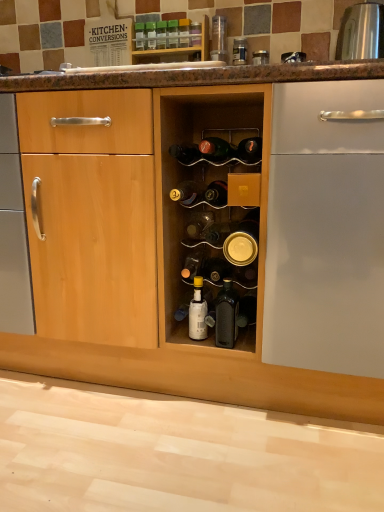
The image size is (384, 512). Describe the element at coordinates (177, 48) in the screenshot. I see `wooden spice rack at upper center` at that location.

What is the approximate height of translucent glass bottle at center, the seventh bottle in the bottom-to-top sequence?

translucent glass bottle at center, the seventh bottle in the bottom-to-top sequence, is 3.16 inches in height.

This screenshot has width=384, height=512. Find the location of `green glass bottle at center`. green glass bottle at center is located at coordinates (216, 149).

In order to face transparent plastic container at upper center, positioned as the 9th bottle in bottom-to-top order, should I rotate leftwards or rightwards?

Turn right approximately 0.521 degrees to face it.

Image resolution: width=384 pixels, height=512 pixels. What do you see at coordinates (195, 34) in the screenshot?
I see `transparent plastic container at upper center, positioned as the 9th bottle in bottom-to-top order` at bounding box center [195, 34].

Locate an element on the screen. matte black bottle at center, marked as the 4th bottle in a bottom-to-top arrangement is located at coordinates (193, 265).

At what (x,y) coordinates should I click in order to perform the action: click on the 9th bottle above when counting from the matte black bottle at center, the 3th bottle when ordered from bottom to top (from the image's perspective). Please return your answer as a coordinate pair (x, y). Looking at the image, I should click on (151, 35).

Would you say green glass bottle at center, acting as the second bottle starting from the top, is inside or outside matte black bottle at center, which is the 11th bottle in top-to-bottom order?

green glass bottle at center, acting as the second bottle starting from the top, is spatially situated outside matte black bottle at center, which is the 11th bottle in top-to-bottom order.

How different are the orientations of green glass bottle at center, the 12th bottle positioned from the bottom, and matte black bottle at center, which is the 11th bottle in top-to-bottom order, in degrees?

green glass bottle at center, the 12th bottle positioned from the bottom, and matte black bottle at center, which is the 11th bottle in top-to-bottom order, are facing 2.62 degrees away from each other.

Consider the image. From the image's perspective, would you say green glass bottle at center, acting as the second bottle starting from the top, is shown under matte black bottle at center, which is the 11th bottle in top-to-bottom order?

No, from the image's perspective, green glass bottle at center, acting as the second bottle starting from the top, is not below matte black bottle at center, which is the 11th bottle in top-to-bottom order.

Choose the correct answer: Is translucent glass bottle at center, the eighth bottle in the top-to-bottom sequence, inside matte black bottle at center, marked as the 4th bottle in a bottom-to-top arrangement, or outside it?

translucent glass bottle at center, the eighth bottle in the top-to-bottom sequence, is not enclosed by matte black bottle at center, marked as the 4th bottle in a bottom-to-top arrangement.

Considering the sizes of translucent glass bottle at center, the eighth bottle in the top-to-bottom sequence, and matte black bottle at center, marked as the 4th bottle in a bottom-to-top arrangement, in the image, is translucent glass bottle at center, the eighth bottle in the top-to-bottom sequence, bigger or smaller than matte black bottle at center, marked as the 4th bottle in a bottom-to-top arrangement,?

A: Considering their sizes, translucent glass bottle at center, the eighth bottle in the top-to-bottom sequence, takes up more space than matte black bottle at center, marked as the 4th bottle in a bottom-to-top arrangement.

Is translucent glass bottle at center, the eighth bottle in the top-to-bottom sequence, facing away from matte black bottle at center, which ranks as the tenth bottle in top-to-bottom order?

translucent glass bottle at center, the eighth bottle in the top-to-bottom sequence, is not turned away from matte black bottle at center, which ranks as the tenth bottle in top-to-bottom order.

From the image's perspective, between translucent glass bottle at center, arranged as the 6th bottle when ordered from the bottom, and matte black bottle at center, which ranks as the tenth bottle in top-to-bottom order, which one is located above?

translucent glass bottle at center, arranged as the 6th bottle when ordered from the bottom.

From the picture: Can you confirm if matte black bottle at center, the 3th bottle when ordered from bottom to top, is positioned to the right of silver metallic kettle at upper right?

No, matte black bottle at center, the 3th bottle when ordered from bottom to top, is not to the right of silver metallic kettle at upper right.

Locate an element on the screen. This screenshot has width=384, height=512. bottle that is the 5th object directly below the silver metallic kettle at upper right (from a real-world perspective) is located at coordinates (215, 270).

Is matte black bottle at center, the 3th bottle when ordered from bottom to top, oriented away from silver metallic kettle at upper right?

No, matte black bottle at center, the 3th bottle when ordered from bottom to top, is not facing the opposite direction of silver metallic kettle at upper right.

Considering the relative positions of matte black bottle at center, which is the 11th bottle in top-to-bottom order, and silver metallic kettle at upper right in the image provided, is matte black bottle at center, which is the 11th bottle in top-to-bottom order, in front of silver metallic kettle at upper right?

Yes, matte black bottle at center, which is the 11th bottle in top-to-bottom order, is in front of silver metallic kettle at upper right.

Is transparent plastic spice jar at upper center, which ranks as the tenth bottle in bottom-to-top order, facing towards silver metallic kettle at upper right?

No.

How much distance is there between transparent plastic spice jar at upper center, acting as the 4th bottle starting from the top, and silver metallic kettle at upper right?

transparent plastic spice jar at upper center, acting as the 4th bottle starting from the top, and silver metallic kettle at upper right are 23.02 inches apart from each other.

In order to click on the 5th bottle behind the silver metallic kettle at upper right, starting your count from the anchor in this screenshot , I will do `click(184, 32)`.

Can we say transparent plastic spice jar at upper center, which ranks as the tenth bottle in bottom-to-top order, lies outside silver metallic kettle at upper right?

transparent plastic spice jar at upper center, which ranks as the tenth bottle in bottom-to-top order, lies outside silver metallic kettle at upper right's area.

Visually, is black glass bottle at center, marked as the thirteenth bottle in a top-to-bottom arrangement, positioned to the left or to the right of translucent plastic spice jar at upper center, acting as the 3th bottle starting from the top?

Clearly, black glass bottle at center, marked as the thirteenth bottle in a top-to-bottom arrangement, is on the right of translucent plastic spice jar at upper center, acting as the 3th bottle starting from the top, in the image.

Would you say black glass bottle at center, arranged as the first bottle when ordered from the bottom, is inside or outside translucent plastic spice jar at upper center, arranged as the eleventh bottle when ordered from the bottom?

black glass bottle at center, arranged as the first bottle when ordered from the bottom, is located beyond the bounds of translucent plastic spice jar at upper center, arranged as the eleventh bottle when ordered from the bottom.

Could you measure the distance between black glass bottle at center, marked as the thirteenth bottle in a top-to-bottom arrangement, and translucent plastic spice jar at upper center, arranged as the eleventh bottle when ordered from the bottom?

The distance of black glass bottle at center, marked as the thirteenth bottle in a top-to-bottom arrangement, from translucent plastic spice jar at upper center, arranged as the eleventh bottle when ordered from the bottom, is 39.22 inches.

From the image's perspective, which is below, black glass bottle at center, arranged as the first bottle when ordered from the bottom, or translucent plastic spice jar at upper center, acting as the 3th bottle starting from the top?

black glass bottle at center, arranged as the first bottle when ordered from the bottom, appears lower in the image.

From the image's perspective, relative to wooden spice rack at upper center, is silver metallic kettle at upper right above or below?

silver metallic kettle at upper right is situated lower than wooden spice rack at upper center in the image.

Based on the photo, between silver metallic kettle at upper right and wooden spice rack at upper center, which one has larger size?

With larger size is wooden spice rack at upper center.

This screenshot has width=384, height=512. In order to click on appliance above the wooden spice rack at upper center (from a real-world perspective) in this screenshot , I will do `click(361, 32)`.

Is silver metallic kettle at upper right with wooden spice rack at upper center?

No, silver metallic kettle at upper right is not beside wooden spice rack at upper center.

From the image's perspective, does transparent plastic spice jar at upper center, acting as the 4th bottle starting from the top, appear higher than wooden spice rack at upper center?

Yes, from the image's perspective, transparent plastic spice jar at upper center, acting as the 4th bottle starting from the top, is on top of wooden spice rack at upper center.

Is transparent plastic spice jar at upper center, acting as the 4th bottle starting from the top, positioned far away from wooden spice rack at upper center?

No.

Is transparent plastic spice jar at upper center, acting as the 4th bottle starting from the top, taller than wooden spice rack at upper center?

No, transparent plastic spice jar at upper center, acting as the 4th bottle starting from the top, is not taller than wooden spice rack at upper center.

Is transparent plastic spice jar at upper center, which ranks as the tenth bottle in bottom-to-top order, to the right of wooden spice rack at upper center from the viewer's perspective?

Correct, you'll find transparent plastic spice jar at upper center, which ranks as the tenth bottle in bottom-to-top order, to the right of wooden spice rack at upper center.

Find the location of `the 9th bottle above the matte black bottle at center, which is the 11th bottle in top-to-bottom order (from the image's perspective)`. the 9th bottle above the matte black bottle at center, which is the 11th bottle in top-to-bottom order (from the image's perspective) is located at coordinates (151, 35).

Locate an element on the screen. The height and width of the screenshot is (512, 384). bottle that is the 3rd object above the matte black bottle at center, which ranks as the tenth bottle in top-to-bottom order (from a real-world perspective) is located at coordinates (198, 224).

Based on their spatial positions, is green glass bottle at upper center, which is the 1th bottle in top-to-bottom order, or translucent glass bottle at center, the eighth bottle in the top-to-bottom sequence, closer to translucent plastic spice jar at upper center, acting as the 3th bottle starting from the top?

The object closer to translucent plastic spice jar at upper center, acting as the 3th bottle starting from the top, is green glass bottle at upper center, which is the 1th bottle in top-to-bottom order.

From the image, which object appears to be nearer to transparent plastic container at upper center, positioned as the 9th bottle in bottom-to-top order, gold metallic can at center, marked as the 9th bottle in a top-to-bottom arrangement, or matte black bottle at center, the 3th bottle when ordered from bottom to top?

gold metallic can at center, marked as the 9th bottle in a top-to-bottom arrangement, lies closer to transparent plastic container at upper center, positioned as the 9th bottle in bottom-to-top order, than the other object.

Based on their spatial positions, is wooden spice rack at upper center or transparent plastic container at upper center, positioned as the 9th bottle in bottom-to-top order, closer to gold metallic can at center, the fifth bottle positioned from the bottom?

Among the two, wooden spice rack at upper center is located nearer to gold metallic can at center, the fifth bottle positioned from the bottom.

Estimate the real-world distances between objects in this image. Which object is further from silver metallic kettle at upper right, matte black bottle at center, which appears as the sixth bottle when viewed from the top, or gold metallic can at center, marked as the 9th bottle in a top-to-bottom arrangement?

gold metallic can at center, marked as the 9th bottle in a top-to-bottom arrangement, is further to silver metallic kettle at upper right.

Looking at the image, which one is located closer to green glass bottle at upper center, which is the 1th bottle in top-to-bottom order, translucent glass bottle at center, the seventh bottle in the bottom-to-top sequence, or matte black bottle at center, the eighth bottle from the bottom?

The object closer to green glass bottle at upper center, which is the 1th bottle in top-to-bottom order, is matte black bottle at center, the eighth bottle from the bottom.

Estimate the real-world distances between objects in this image. Which object is further from translucent glass bottle at center, marked as the seventh bottle in a top-to-bottom arrangement, translucent glass bottle at center, the eighth bottle in the top-to-bottom sequence, or matte black bottle at center, which appears as the sixth bottle when viewed from the top?

matte black bottle at center, which appears as the sixth bottle when viewed from the top, is further to translucent glass bottle at center, marked as the seventh bottle in a top-to-bottom arrangement.

When comparing their distances from translucent plastic spice jar at upper center, acting as the 3th bottle starting from the top, does translucent glass bottle at center, arranged as the 6th bottle when ordered from the bottom, or translucent glass bottle at center, marked as the seventh bottle in a top-to-bottom arrangement, seem further?

translucent glass bottle at center, arranged as the 6th bottle when ordered from the bottom, lies further to translucent plastic spice jar at upper center, acting as the 3th bottle starting from the top, than the other object.

From the image, which object appears to be nearer to transparent plastic spice jar at upper center, which ranks as the tenth bottle in bottom-to-top order, matte black bottle at center, which is the 11th bottle in top-to-bottom order, or matte black bottle at center, marked as the 4th bottle in a bottom-to-top arrangement?

matte black bottle at center, marked as the 4th bottle in a bottom-to-top arrangement, lies closer to transparent plastic spice jar at upper center, which ranks as the tenth bottle in bottom-to-top order, than the other object.

You are a GUI agent. You are given a task and a screenshot of the screen. Output one action in this format:
    pyautogui.click(x=<x>, y=<y>)
    Task: Click on the appliance between transparent plastic spice jar at upper center, which ranks as the tenth bottle in bottom-to-top order, and gold metallic can at center, marked as the 9th bottle in a top-to-bottom arrangement, vertically
    
    Given the screenshot: What is the action you would take?
    pyautogui.click(x=361, y=32)

I want to click on bottle between transparent plastic container at upper center, the 5th bottle viewed from the top, and translucent glass bottle at center, the seventh bottle in the bottom-to-top sequence, in the vertical direction, so click(x=250, y=150).

Locate an element on the screen. The height and width of the screenshot is (512, 384). cabinet between green glass bottle at center, acting as the second bottle starting from the top, and translucent glass bottle at center, the eighth bottle in the top-to-bottom sequence, vertically is located at coordinates (177, 48).

Find the location of a particular element. The image size is (384, 512). cabinet between transparent plastic spice jar at upper center, acting as the 4th bottle starting from the top, and matte black bottle at center, which appears as the sixth bottle when viewed from the top, vertically is located at coordinates (177, 48).